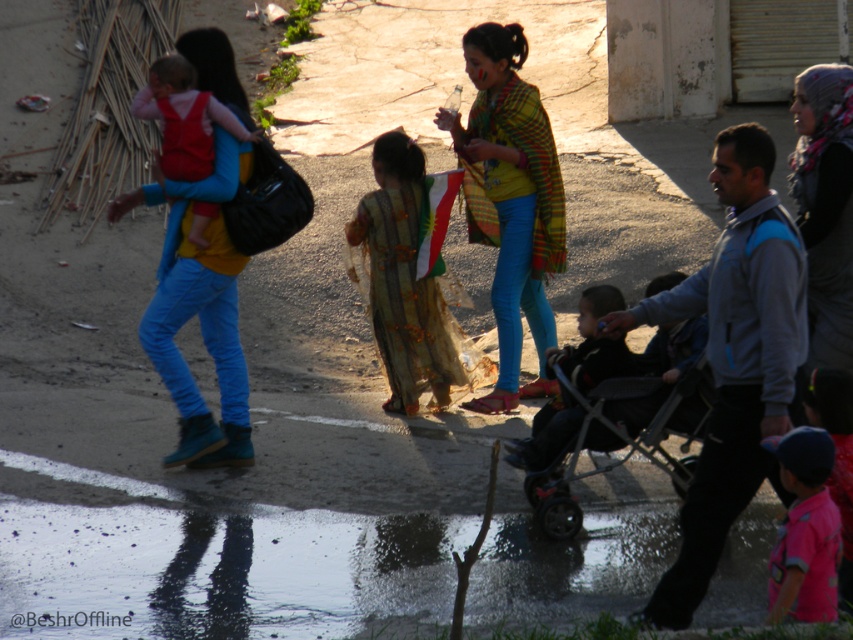
Who is higher up, gray fleece jacket at center or metallic gray stroller at center?

Positioned higher is gray fleece jacket at center.

Is gray fleece jacket at center positioned before metallic gray stroller at center?

Yes, it is.

Who is more distant from viewer, (677, 294) or (556, 452)?

Positioned behind is point (556, 452).

Find the location of `gray fleece jacket at center`. gray fleece jacket at center is located at coordinates (733, 358).

Can you confirm if yellow fabric scarf at center is taller than matte yellow shirt at left?

Indeed, yellow fabric scarf at center has a greater height compared to matte yellow shirt at left.

Does yellow fabric scarf at center come behind matte yellow shirt at left?

Yes, yellow fabric scarf at center is behind matte yellow shirt at left.

Identify the location of yellow fabric scarf at center. (509, 200).

Between matte yellow shirt at left and matte red vest at upper left, which one has more height?

With more height is matte yellow shirt at left.

Who is positioned more to the left, matte yellow shirt at left or matte red vest at upper left?

matte yellow shirt at left

Is point (228, 445) positioned after point (154, 77)?

Yes, point (228, 445) is farther from viewer.

Find the location of a particular element. The height and width of the screenshot is (640, 853). matte yellow shirt at left is located at coordinates (198, 312).